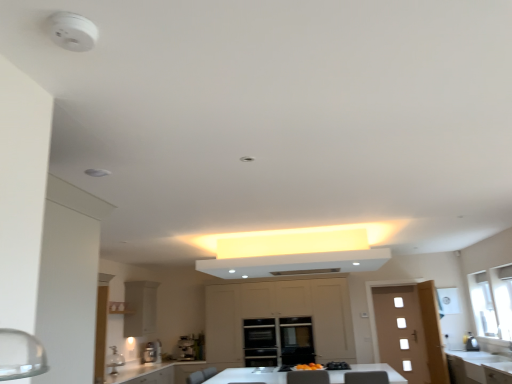
The image size is (512, 384). Identify the location of transparent glass door at center. (296, 340).

Image resolution: width=512 pixels, height=384 pixels. What do you see at coordinates (296, 340) in the screenshot? I see `transparent glass door at center` at bounding box center [296, 340].

Find the location of a particular element. This screenshot has height=384, width=512. satin silver kettle at right is located at coordinates (471, 342).

You are a GUI agent. You are given a task and a screenshot of the screen. Output one action in this format:
    pyautogui.click(x=<x>, y=<y>)
    Task: Click on the white glossy countertop at lower right, positioned as the 2th countertop in left-to-right order
    The width and height of the screenshot is (512, 384).
    Given the screenshot: What is the action you would take?
    pyautogui.click(x=471, y=366)

Consider the image. How much space does white glossy countertop at lower right, positioned as the 1th countertop in right-to-left order, occupy vertically?

The height of white glossy countertop at lower right, positioned as the 1th countertop in right-to-left order, is 26.34 inches.

At what (x,y) coordinates should I click in order to perform the action: click on matte beige cabinetry at center, which is the 1th cabinetry from right to left. Please return your answer as a coordinate pair (x, y). This screenshot has height=384, width=512. Looking at the image, I should click on [279, 315].

Measure the distance between satin silver coffee machine at lower center, acting as the 1th coffee machine starting from the right, and camera.

A distance of 7.14 meters exists between satin silver coffee machine at lower center, acting as the 1th coffee machine starting from the right, and camera.

The width and height of the screenshot is (512, 384). What are the coordinates of `white glossy countertop at center, positioned as the second countertop in right-to-left order` in the screenshot? It's located at (156, 373).

Is satin silver kettle at right positioned with its back to wooden door at right?

No, satin silver kettle at right's orientation is not away from wooden door at right.

Based on the photo, which object is closer to the camera taking this photo, satin silver kettle at right or wooden door at right?

satin silver kettle at right is closer to the camera.

Where is `door located on the left of satin silver kettle at right`? Image resolution: width=512 pixels, height=384 pixels. door located on the left of satin silver kettle at right is located at coordinates click(x=409, y=331).

Can you confirm if satin silver kettle at right is shorter than wooden door at right?

Yes, satin silver kettle at right is shorter than wooden door at right.

Is the position of matte beige cabinetry at center, the 2th cabinetry in the left-to-right sequence, more distant than that of transparent glass window at right?

Yes, matte beige cabinetry at center, the 2th cabinetry in the left-to-right sequence, is further from the viewer.

Considering the sizes of objects matte beige cabinetry at center, which is the 1th cabinetry from right to left, and transparent glass window at right in the image provided, who is wider, matte beige cabinetry at center, which is the 1th cabinetry from right to left, or transparent glass window at right?

With larger width is matte beige cabinetry at center, which is the 1th cabinetry from right to left.

Is matte beige cabinetry at center, the 2th cabinetry in the left-to-right sequence, beside transparent glass window at right?

No.

Visually, is matte beige cabinetry at center, which is the 1th cabinetry from right to left, positioned to the left or to the right of transparent glass window at right?

In the image, matte beige cabinetry at center, which is the 1th cabinetry from right to left, appears on the left side of transparent glass window at right.

From a real-world perspective, does white glossy countertop at center, placed as the 1th countertop when sorted from left to right, stand above satin silver coffee machine at center, acting as the 1th coffee machine starting from the left?

No, from a real-world perspective, white glossy countertop at center, placed as the 1th countertop when sorted from left to right, is not on top of satin silver coffee machine at center, acting as the 1th coffee machine starting from the left.

Between point (352, 368) and point (159, 344), which one is positioned behind?

The point (159, 344) is more distant.

Considering the relative positions of white glossy countertop at center, placed as the 1th countertop when sorted from left to right, and satin silver coffee machine at center, acting as the 1th coffee machine starting from the left, in the image provided, is white glossy countertop at center, placed as the 1th countertop when sorted from left to right, to the left or to the right of satin silver coffee machine at center, acting as the 1th coffee machine starting from the left,?

From the image, it's evident that white glossy countertop at center, placed as the 1th countertop when sorted from left to right, is to the right of satin silver coffee machine at center, acting as the 1th coffee machine starting from the left.

Which is in front, point (157, 346) or point (354, 346)?

Positioned in front is point (157, 346).

Is satin silver coffee machine at center, placed as the second coffee machine when sorted from right to left, oriented towards matte beige cabinetry at center, the 2th cabinetry in the left-to-right sequence?

No, satin silver coffee machine at center, placed as the second coffee machine when sorted from right to left, does not turn towards matte beige cabinetry at center, the 2th cabinetry in the left-to-right sequence.

Locate an element on the screen. the 1st coffee machine behind the matte beige cabinetry at center, which is the 1th cabinetry from right to left is located at coordinates (152, 352).

Considering the relative sizes of white glossy countertop at lower right, positioned as the 2th countertop in left-to-right order, and satin silver coffee machine at center, placed as the second coffee machine when sorted from right to left, in the image provided, is white glossy countertop at lower right, positioned as the 2th countertop in left-to-right order, shorter than satin silver coffee machine at center, placed as the second coffee machine when sorted from right to left,?

No, white glossy countertop at lower right, positioned as the 2th countertop in left-to-right order, is not shorter than satin silver coffee machine at center, placed as the second coffee machine when sorted from right to left.

Is white glossy countertop at lower right, positioned as the 2th countertop in left-to-right order, far from satin silver coffee machine at center, placed as the second coffee machine when sorted from right to left?

Absolutely, white glossy countertop at lower right, positioned as the 2th countertop in left-to-right order, is distant from satin silver coffee machine at center, placed as the second coffee machine when sorted from right to left.

Is white glossy countertop at lower right, positioned as the 2th countertop in left-to-right order, facing away from satin silver coffee machine at center, placed as the second coffee machine when sorted from right to left?

No, satin silver coffee machine at center, placed as the second coffee machine when sorted from right to left, is not at the back of white glossy countertop at lower right, positioned as the 2th countertop in left-to-right order.

The width and height of the screenshot is (512, 384). Find the location of `coffee machine that is the 2nd object to the left of the white glossy countertop at lower right, positioned as the 2th countertop in left-to-right order, starting at the anchor`. coffee machine that is the 2nd object to the left of the white glossy countertop at lower right, positioned as the 2th countertop in left-to-right order, starting at the anchor is located at coordinates (152, 352).

From a real-world perspective, is white matte cabinet at center, the first cabinetry when ordered from left to right, located beneath satin silver coffee machine at lower center, acting as the 1th coffee machine starting from the right?

No, from a real-world perspective, white matte cabinet at center, the first cabinetry when ordered from left to right, is not beneath satin silver coffee machine at lower center, acting as the 1th coffee machine starting from the right.

Is white matte cabinet at center, placed as the second cabinetry when sorted from right to left, far away from satin silver coffee machine at lower center, acting as the second coffee machine starting from the left?

They are positioned close to each other.

Between white matte cabinet at center, placed as the second cabinetry when sorted from right to left, and satin silver coffee machine at lower center, acting as the 1th coffee machine starting from the right, which one appears on the left side from the viewer's perspective?

white matte cabinet at center, placed as the second cabinetry when sorted from right to left.

Is white matte cabinet at center, the first cabinetry when ordered from left to right, shorter than satin silver coffee machine at lower center, acting as the 1th coffee machine starting from the right?

No, white matte cabinet at center, the first cabinetry when ordered from left to right, is not shorter than satin silver coffee machine at lower center, acting as the 1th coffee machine starting from the right.

Would you say satin silver coffee machine at center, acting as the 1th coffee machine starting from the left, is to the left or to the right of white matte cabinet at center, placed as the second cabinetry when sorted from right to left, in the picture?

Based on their positions, satin silver coffee machine at center, acting as the 1th coffee machine starting from the left, is located to the right of white matte cabinet at center, placed as the second cabinetry when sorted from right to left.

The width and height of the screenshot is (512, 384). What are the coordinates of `cabinetry on the left of satin silver coffee machine at center, acting as the 1th coffee machine starting from the left` in the screenshot? It's located at (140, 308).

Between satin silver coffee machine at center, acting as the 1th coffee machine starting from the left, and white matte cabinet at center, the first cabinetry when ordered from left to right, which one has larger width?

white matte cabinet at center, the first cabinetry when ordered from left to right, is wider.

What's the angular difference between satin silver coffee machine at center, placed as the second coffee machine when sorted from right to left, and white matte cabinet at center, the first cabinetry when ordered from left to right,'s facing directions?

21 degrees separate the facing orientations of satin silver coffee machine at center, placed as the second coffee machine when sorted from right to left, and white matte cabinet at center, the first cabinetry when ordered from left to right.

Where is `appliance located on the right of wooden door at right`? This screenshot has height=384, width=512. appliance located on the right of wooden door at right is located at coordinates (471, 342).

The height and width of the screenshot is (384, 512). In order to click on the 2nd cabinetry behind when counting from the transparent glass window at right in this screenshot , I will do `click(279, 315)`.

Estimate the real-world distances between objects in this image. Which object is further from white glossy countertop at lower right, positioned as the 1th countertop in right-to-left order, white glossy countertop at center, placed as the 1th countertop when sorted from left to right, or satin silver kettle at right?

white glossy countertop at center, placed as the 1th countertop when sorted from left to right, is further to white glossy countertop at lower right, positioned as the 1th countertop in right-to-left order.

Which object lies nearer to the anchor point satin silver coffee machine at lower center, acting as the second coffee machine starting from the left, white glossy countertop at center, placed as the 1th countertop when sorted from left to right, or matte black oven at center?

Among the two, white glossy countertop at center, placed as the 1th countertop when sorted from left to right, is located nearer to satin silver coffee machine at lower center, acting as the second coffee machine starting from the left.

Considering their positions, is white glossy countertop at lower right, positioned as the 1th countertop in right-to-left order, positioned closer to matte beige cabinetry at center, which is the 1th cabinetry from right to left, than white matte cabinet at center, the first cabinetry when ordered from left to right?

white matte cabinet at center, the first cabinetry when ordered from left to right, lies closer to matte beige cabinetry at center, which is the 1th cabinetry from right to left, than the other object.

Which object lies nearer to the anchor point satin silver coffee machine at center, acting as the 1th coffee machine starting from the left, transparent glass window at right or transparent glass door at center?

transparent glass door at center.

When comparing their distances from white matte cabinet at center, placed as the second cabinetry when sorted from right to left, does matte black oven at center or satin silver coffee machine at lower center, acting as the 1th coffee machine starting from the right, seem closer?

Among the two, satin silver coffee machine at lower center, acting as the 1th coffee machine starting from the right, is located nearer to white matte cabinet at center, placed as the second cabinetry when sorted from right to left.

Based on their spatial positions, is satin silver coffee machine at center, placed as the second coffee machine when sorted from right to left, or wooden door at right further from satin silver coffee machine at lower center, acting as the second coffee machine starting from the left?

The object further to satin silver coffee machine at lower center, acting as the second coffee machine starting from the left, is wooden door at right.

Estimate the real-world distances between objects in this image. Which object is further from matte beige cabinetry at center, which is the 1th cabinetry from right to left, white glossy countertop at center, placed as the 1th countertop when sorted from left to right, or transparent glass window at right?

Among the two, transparent glass window at right is located further to matte beige cabinetry at center, which is the 1th cabinetry from right to left.

Estimate the real-world distances between objects in this image. Which object is further from white matte cabinet at center, placed as the second cabinetry when sorted from right to left, white glossy countertop at center, positioned as the second countertop in right-to-left order, or wooden door at right?

wooden door at right is further to white matte cabinet at center, placed as the second cabinetry when sorted from right to left.

At what (x,y) coordinates should I click in order to perform the action: click on glass door positioned between white glossy exhaust hood at center and satin silver coffee machine at lower center, acting as the 1th coffee machine starting from the right, from near to far. Please return your answer as a coordinate pair (x, y). The height and width of the screenshot is (384, 512). Looking at the image, I should click on (296, 340).

At what (x,y) coordinates should I click in order to perform the action: click on cabinetry between satin silver coffee machine at center, acting as the 1th coffee machine starting from the left, and transparent glass window at right from left to right. Please return your answer as a coordinate pair (x, y). Looking at the image, I should click on (279, 315).

Locate an element on the screen. This screenshot has width=512, height=384. cabinetry between matte black oven at center and white glossy countertop at lower right, positioned as the 1th countertop in right-to-left order, from left to right is located at coordinates (279, 315).

Find the location of a particular element. Image resolution: width=512 pixels, height=384 pixels. cabinetry situated between matte black oven at center and satin silver kettle at right from left to right is located at coordinates (279, 315).